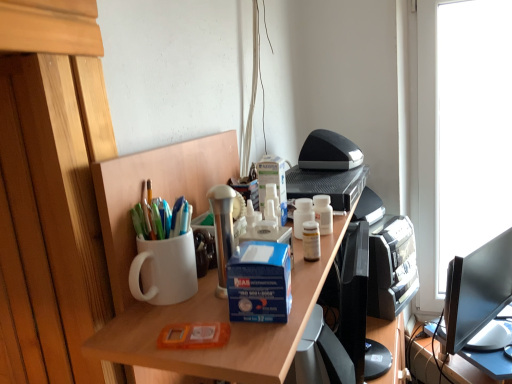
Question: Is orange plastic case at center, arranged as the first stationery when ordered from the bottom, taller or shorter than white matte desk at center?

Choices:
 (A) tall
 (B) short

Answer: (B)

Question: Considering the positions of orange plastic case at center, arranged as the first stationery when ordered from the bottom, and white matte desk at center in the image, is orange plastic case at center, arranged as the first stationery when ordered from the bottom, wider or thinner than white matte desk at center?

Choices:
 (A) thin
 (B) wide

Answer: (A)

Question: Estimate the real-world distances between objects in this image. Which object is farther from the blue cardboard box at center?

Choices:
 (A) white glossy bottle at upper center, acting as the second stationery starting from the left
 (B) orange plastic case at center, the 2th stationery viewed from the right
 (C) white matte desk at center

Answer: (A)

Question: Which object is positioned closest to the white matte desk at center?

Choices:
 (A) white glossy bottle at upper center, the second stationery from the front
 (B) orange plastic case at center, which is counted as the 1th stationery, starting from the front
 (C) blue cardboard box at center

Answer: (C)